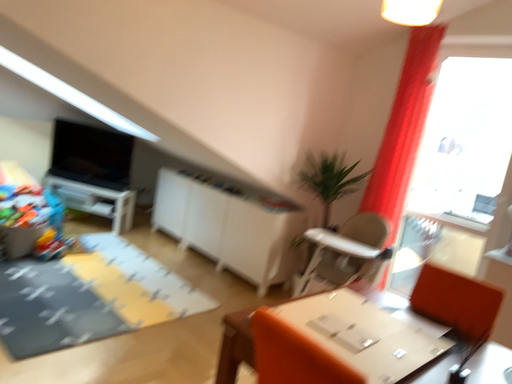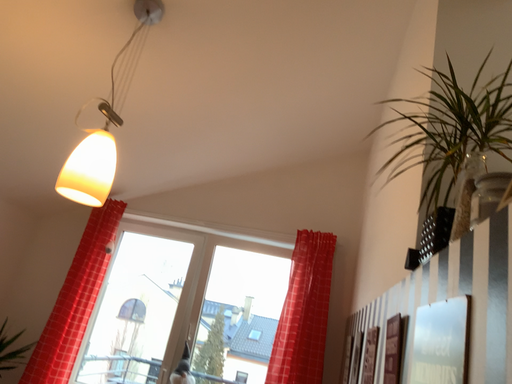
Question: How did the camera likely rotate when shooting the video?

Choices:
 (A) rotated upward
 (B) rotated downward

Answer: (A)